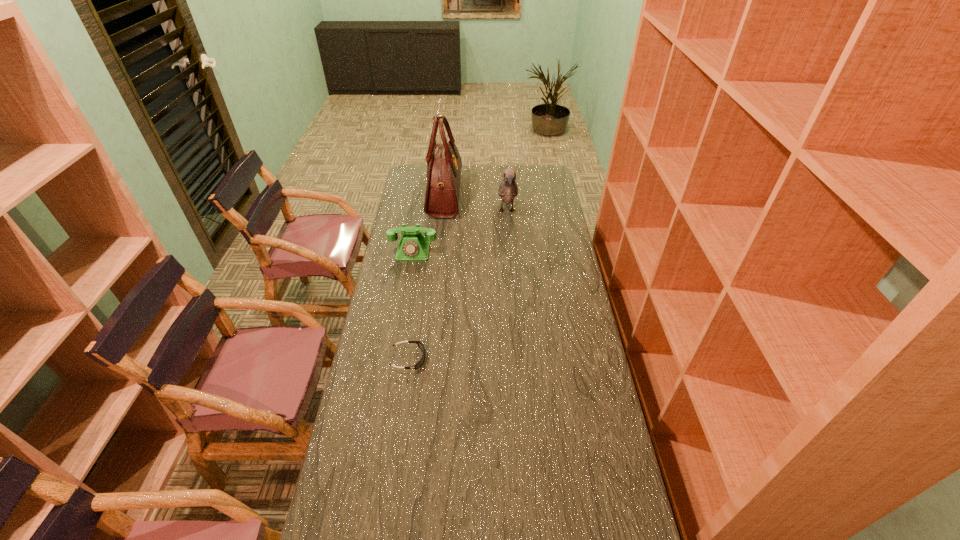
This screenshot has height=540, width=960. I want to click on the tallest object, so click(x=444, y=163).

This screenshot has height=540, width=960. I want to click on parrot, so click(x=508, y=190).

I want to click on the second tallest object, so 508,190.

In order to click on the third farthest object in this screenshot , I will do `click(413, 246)`.

This screenshot has height=540, width=960. What are the coordinates of `telephone` in the screenshot? It's located at (413, 246).

Locate an element on the screen. Image resolution: width=960 pixels, height=540 pixels. goggles is located at coordinates (420, 345).

This screenshot has width=960, height=540. In order to click on the nearest object in this screenshot , I will do `click(420, 345)`.

Where is `free region located on the front-facing side of the tallest object`? free region located on the front-facing side of the tallest object is located at coordinates (516, 194).

Locate an element on the screen. Image resolution: width=960 pixels, height=540 pixels. vacant position located 0.320m on the front-facing side of the rightmost object is located at coordinates (512, 271).

This screenshot has height=540, width=960. I want to click on vacant space located on the dial of the third farthest object, so click(x=409, y=278).